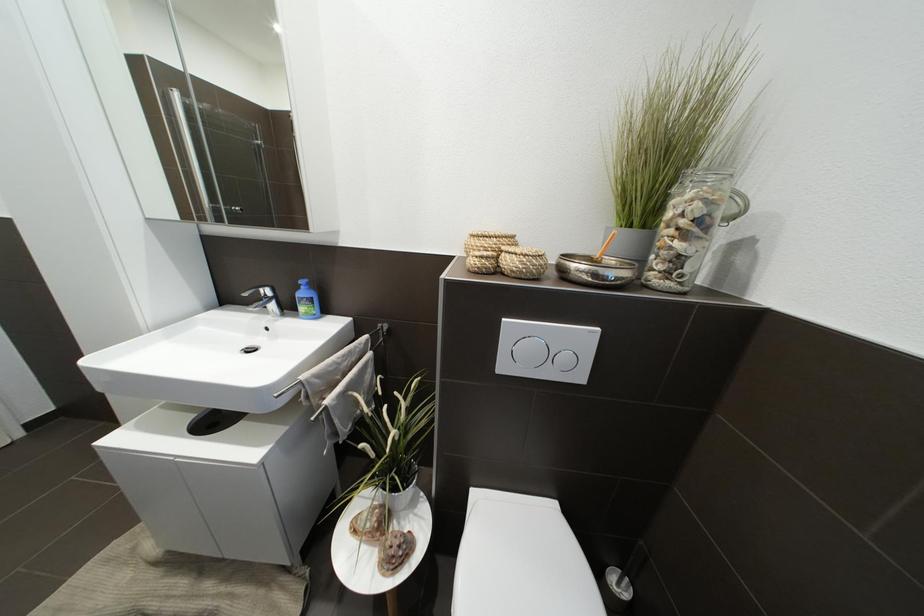
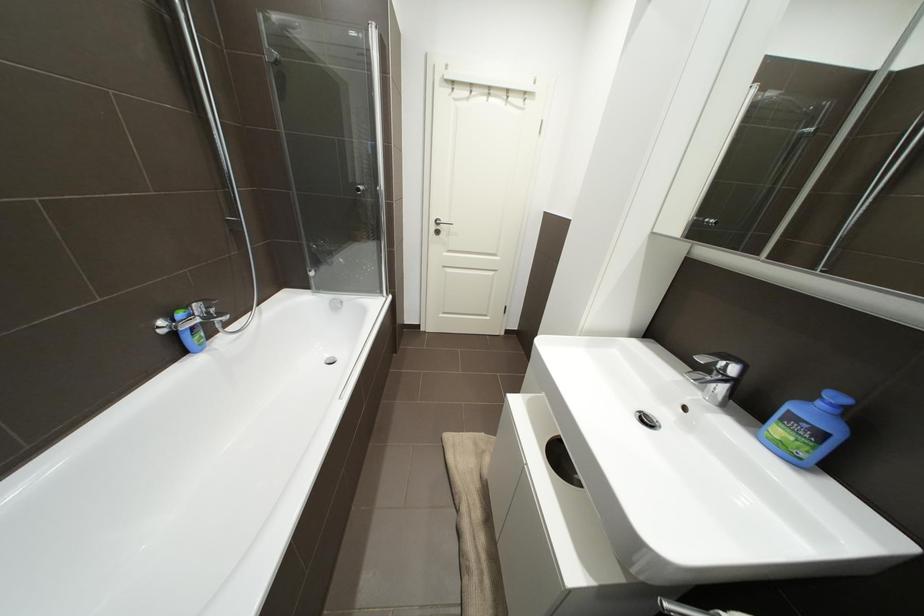
Based on the continuous images, in which direction is the camera rotating?

The camera's rotation is toward left-down.